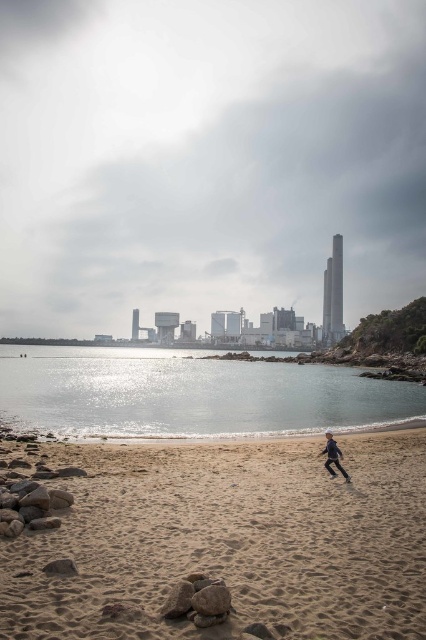
Is smooth gray rock at lower center to the left of dark blue fabric person at lower right from the viewer's perspective?

Correct, you'll find smooth gray rock at lower center to the left of dark blue fabric person at lower right.

Who is more distant from viewer, [221,605] or [327,467]?

Positioned behind is point [327,467].

The height and width of the screenshot is (640, 426). Describe the element at coordinates (212, 600) in the screenshot. I see `smooth gray rock at lower center` at that location.

Find the location of a particular element. This screenshot has width=426, height=640. smooth gray rock at lower center is located at coordinates (212, 600).

Does sandy beach at lower center come in front of smooth gray rock at lower center?

Yes, it is.

Is point (8, 596) closer to camera compared to point (207, 596)?

No, (8, 596) is further to viewer.

Between point (271, 605) and point (201, 612), which one is positioned behind?

The point (271, 605) is behind.

I want to click on sandy beach at lower center, so click(230, 540).

Who is more distant from viewer, (37, 396) or (206, 600)?

The point (37, 396) is behind.

Can you confirm if clear water at center is positioned below smooth gray rock at lower center?

Yes.

Looking at this image, measure the distance between clear water at center and camera.

They are 33.60 meters apart.

At what (x,y) coordinates should I click in order to perform the action: click on clear water at center. Please return your answer as a coordinate pair (x, y). This screenshot has width=426, height=640. Looking at the image, I should click on (189, 394).